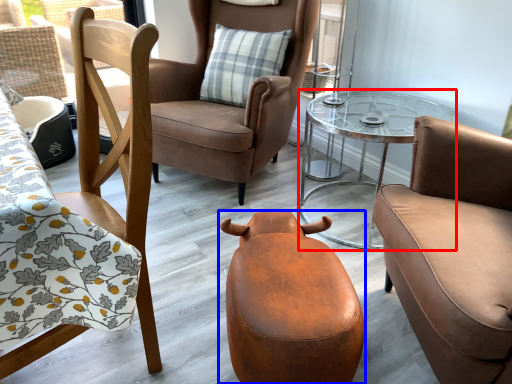
Question: Which point is closer to the camera, table (highlighted by a red box) or swivel chair (highlighted by a blue box)?

Choices:
 (A) table
 (B) swivel chair

Answer: (B)